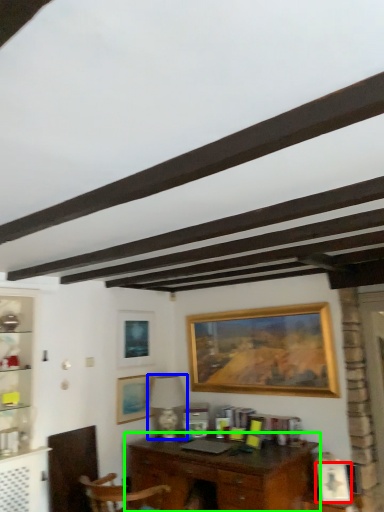
Question: Which object is the farthest from picture frame (highlighted by a red box)? Choose among these: lamp (highlighted by a blue box) or desk (highlighted by a green box).

Choices:
 (A) lamp
 (B) desk

Answer: (A)